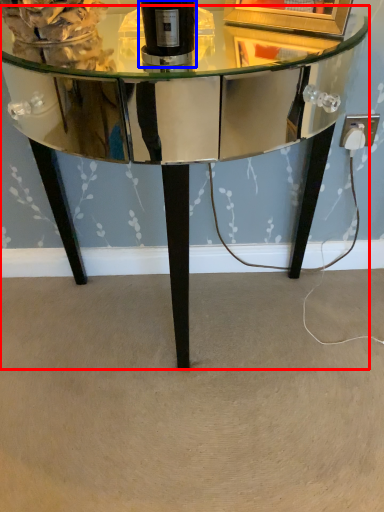
Question: Which object appears closest to the camera in this image, table (highlighted by a red box) or bottle (highlighted by a blue box)?

Choices:
 (A) table
 (B) bottle

Answer: (A)